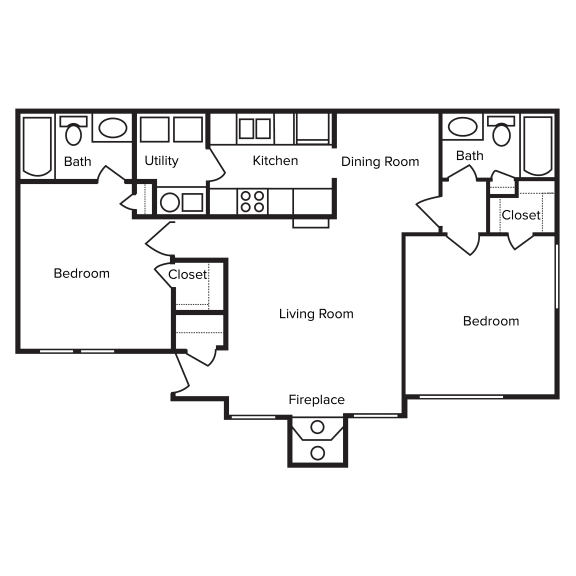
Where is `window`? window is located at coordinates (367, 413), (263, 416), (441, 392), (89, 348), (63, 351), (559, 288).